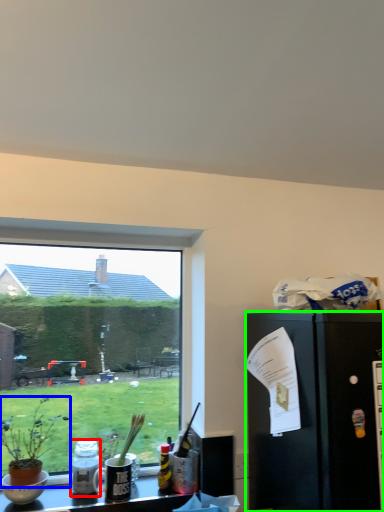
Question: Which object is positioned farthest from bottle (highlighted by a red box)? Select from houseplant (highlighted by a blue box) and refrigerator (highlighted by a green box).

Choices:
 (A) houseplant
 (B) refrigerator

Answer: (B)